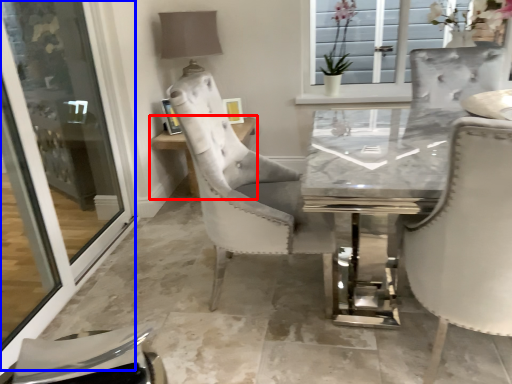
Question: Which point is closer to the camera, table (highlighted by a red box) or screen door (highlighted by a blue box)?

Choices:
 (A) table
 (B) screen door

Answer: (B)